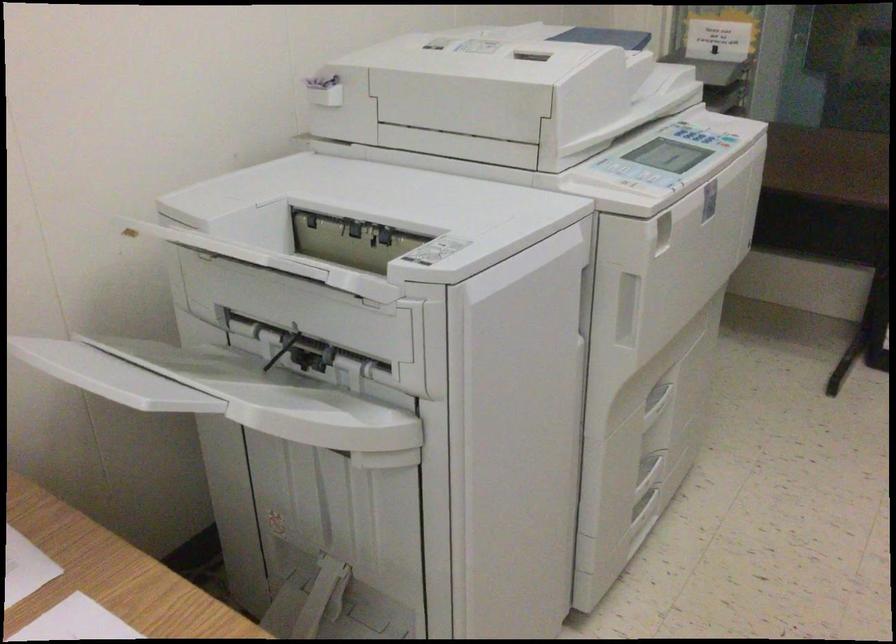
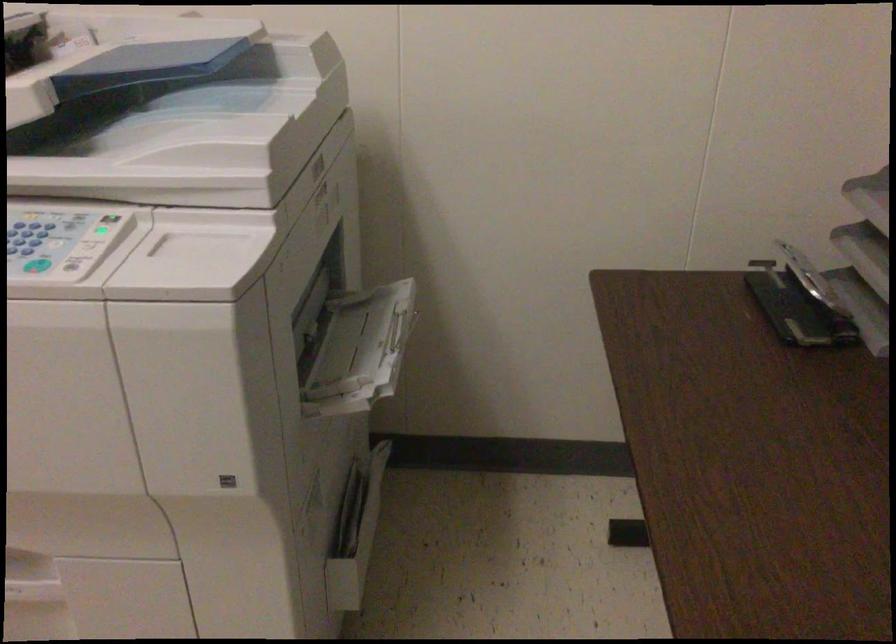
In the second image, find the point that corresponds to [619,75] in the first image.

(173, 126)